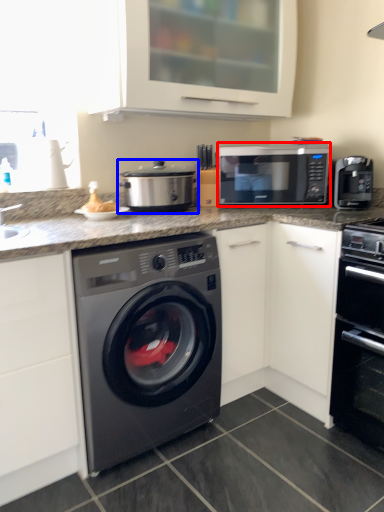
Question: Which of the following is the farthest to the observer, microwave oven (highlighted by a red box) or appliance (highlighted by a blue box)?

Choices:
 (A) microwave oven
 (B) appliance

Answer: (A)